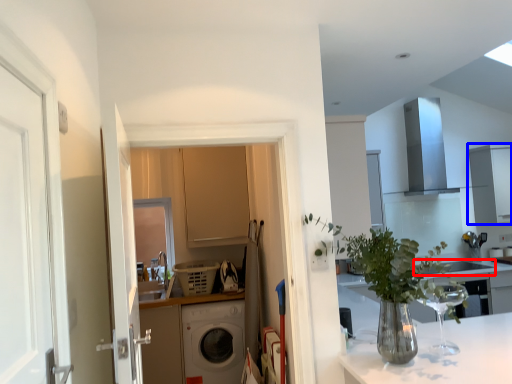
Question: Which object appears closest to the camera in this image, sink (highlighted by a red box) or cabinetry (highlighted by a blue box)?

Choices:
 (A) sink
 (B) cabinetry

Answer: (A)